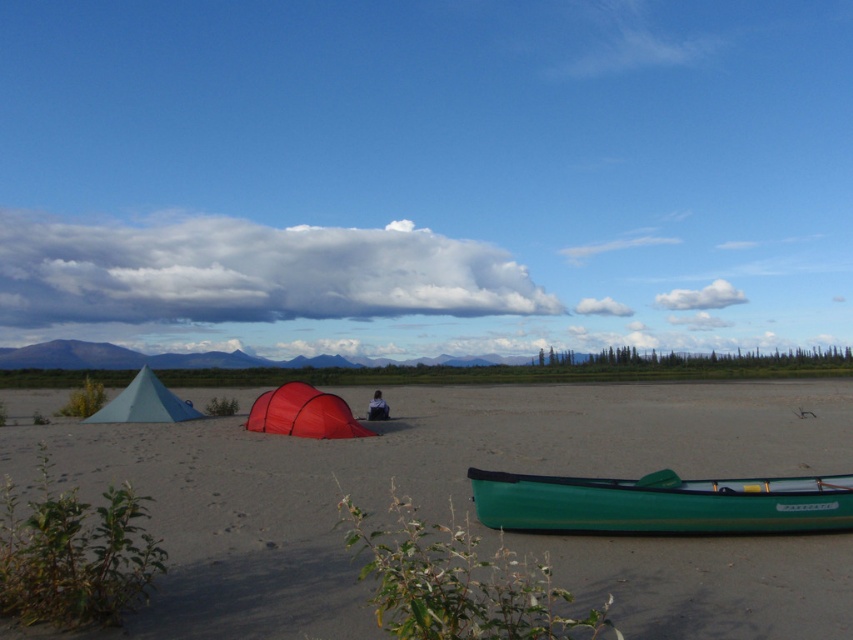
You are a camper who wants to place a small first aid kit on the dark blue fabric at center without it being under the green glossy canoe at lower center. Is this possible?

The green glossy canoe at lower center is located above the dark blue fabric at center, so placing the first aid kit on the dark blue fabric at center would require placing it underneath the canoe. Therefore, it is not possible to place the first aid kit on the dark blue fabric at center without it being under the green glossy canoe at lower center.

You are a photographer standing at the camera position. You want to take a photo that includes both the point at location point (231,612) and the point at location point (358,435). Which point will appear larger in the photo?

Point (231,612) will appear larger in the photo because it is closer to the camera than point (358,435).